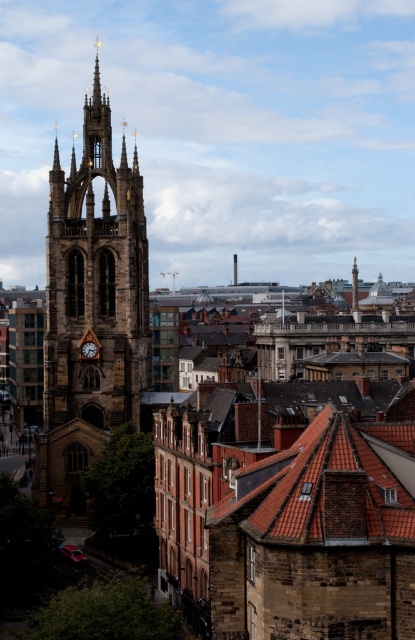
You are standing in the city square and looking at the Gothic church tower. There are two points marked on the ground in front of you. The first point is at coordinates point (138, 262) and the second is at point (92, 346). If you want to place a small flower pot at the point that is closer to the camera, which coordinate should you choose?

Point (92, 346) is closer to the camera than point (138, 262), so you should place the flower pot at point (92, 346).